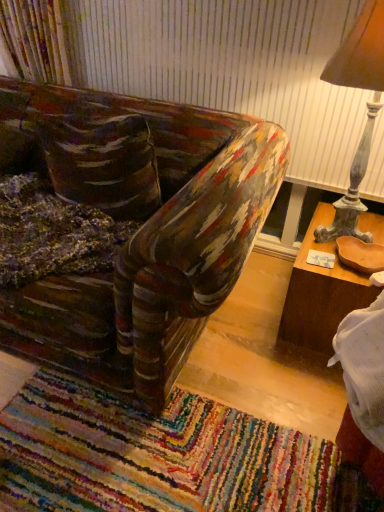
Question: Does multicolored woven mat at lower center have a lesser height compared to brown wood table at right?

Choices:
 (A) no
 (B) yes

Answer: (B)

Question: Does multicolored woven mat at lower center have a smaller size compared to brown wood table at right?

Choices:
 (A) yes
 (B) no

Answer: (A)

Question: From the image's perspective, would you say multicolored woven mat at lower center is positioned over brown wood table at right?

Choices:
 (A) yes
 (B) no

Answer: (B)

Question: Is there a large distance between multicolored woven mat at lower center and brown wood table at right?

Choices:
 (A) no
 (B) yes

Answer: (A)

Question: Does multicolored woven mat at lower center touch brown wood table at right?

Choices:
 (A) no
 (B) yes

Answer: (A)

Question: Considering the positions of brown wood table at right and multicolored woven mat at lower center in the image, is brown wood table at right taller or shorter than multicolored woven mat at lower center?

Choices:
 (A) tall
 (B) short

Answer: (A)

Question: Is brown wood table at right in front of or behind multicolored woven mat at lower center in the image?

Choices:
 (A) behind
 (B) front

Answer: (A)

Question: Is brown wood table at right wider or thinner than multicolored woven mat at lower center?

Choices:
 (A) thin
 (B) wide

Answer: (A)

Question: From a real-world perspective, relative to multicolored woven mat at lower center, is brown wood table at right vertically above or below?

Choices:
 (A) below
 (B) above

Answer: (B)

Question: In terms of height, does brown wood table at right look taller or shorter compared to wooden lampshade at right?

Choices:
 (A) tall
 (B) short

Answer: (B)

Question: Is brown wood table at right to the left or to the right of wooden lampshade at right in the image?

Choices:
 (A) right
 (B) left

Answer: (A)

Question: Is point (319, 279) positioned closer to the camera than point (339, 55)?

Choices:
 (A) closer
 (B) farther

Answer: (B)

Question: Is brown wood table at right in front of or behind wooden lampshade at right in the image?

Choices:
 (A) behind
 (B) front

Answer: (A)

Question: Is wooden lampshade at right inside or outside of multicolored woven mat at lower center?

Choices:
 (A) inside
 (B) outside

Answer: (B)

Question: Is wooden lampshade at right to the left or to the right of multicolored woven mat at lower center in the image?

Choices:
 (A) right
 (B) left

Answer: (A)